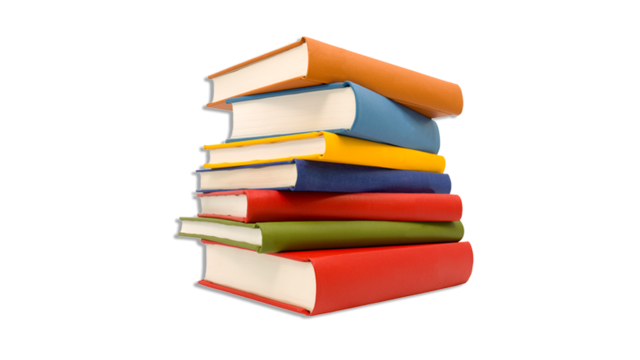
Where is `books`? Image resolution: width=640 pixels, height=360 pixels. books is located at coordinates [x=310, y=63], [x=317, y=113], [x=316, y=146], [x=312, y=176], [x=294, y=203], [x=289, y=231], [x=298, y=268].